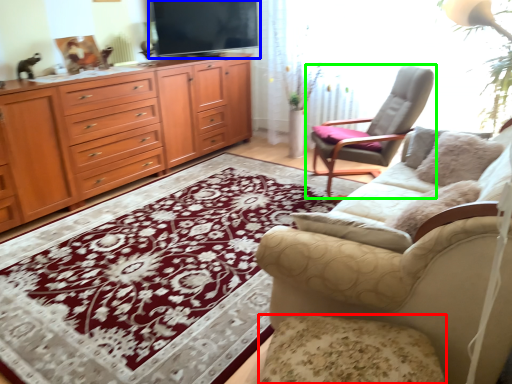
Question: Based on their relative distances, which object is nearer to footrest (highlighted by a red box)? Choose from television (highlighted by a blue box) and chair (highlighted by a green box).

Choices:
 (A) television
 (B) chair

Answer: (B)